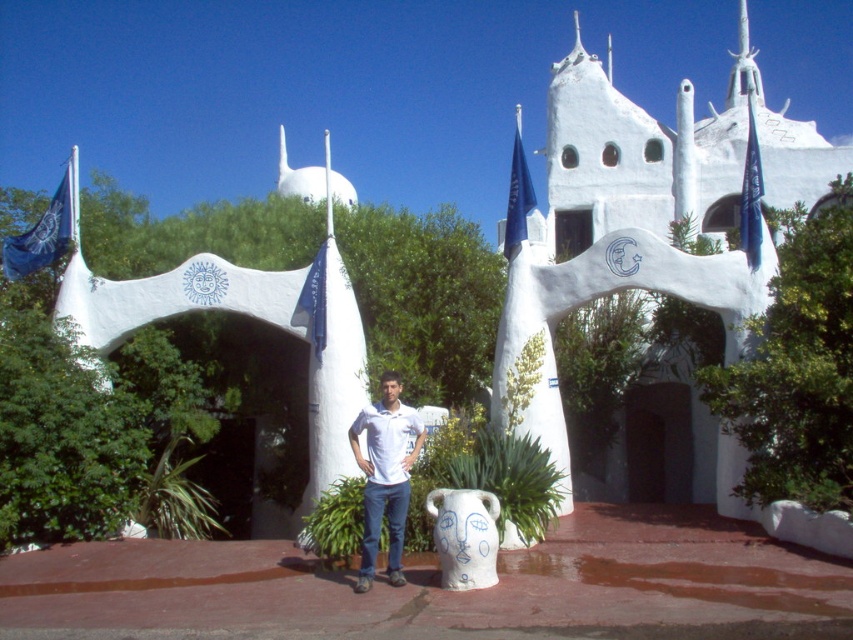
Which is below, white cotton shirt at center or blue fabric flag at upper right?

white cotton shirt at center

Is point (405, 515) positioned before point (759, 246)?

Yes.

This screenshot has width=853, height=640. Describe the element at coordinates (386, 476) in the screenshot. I see `white cotton shirt at center` at that location.

Identify the location of white cotton shirt at center. (386, 476).

Who is positioned more to the right, white cotton shirt at center or blue fabric flag at center?

Positioned to the right is white cotton shirt at center.

This screenshot has width=853, height=640. I want to click on white cotton shirt at center, so pos(386,476).

Who is more distant from viewer, (36,243) or (755,196)?

Point (36,243)

Between blue fabric flag at upper left and blue fabric flag at upper right, which one is positioned higher?

blue fabric flag at upper left is above.

Does point (44, 250) come farther from viewer compared to point (749, 236)?

Yes, point (44, 250) is behind point (749, 236).

Locate an element on the screen. The height and width of the screenshot is (640, 853). blue fabric flag at upper left is located at coordinates (44, 232).